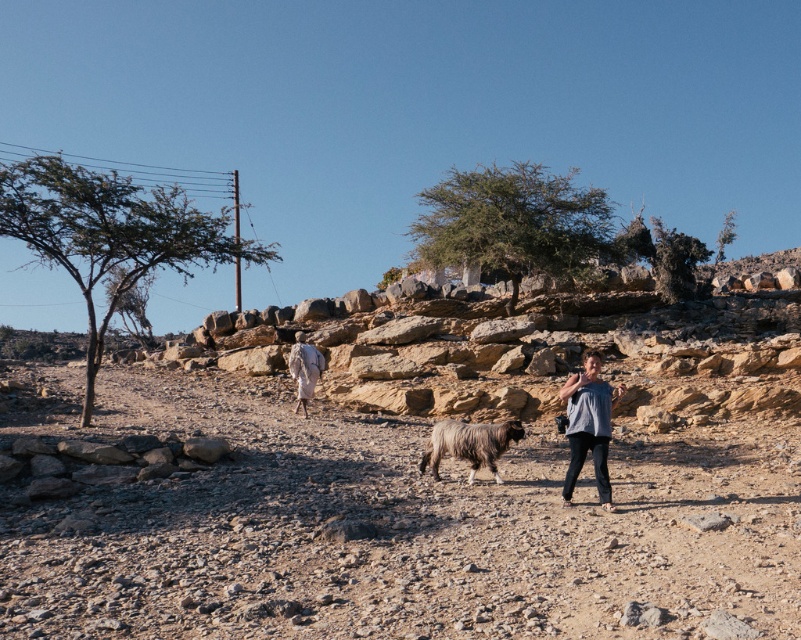
Does green leafy tree at center have a lesser width compared to green leafy tree at upper right?

In fact, green leafy tree at center might be wider than green leafy tree at upper right.

Which is behind, point (501, 252) or point (723, 236)?

Positioned behind is point (723, 236).

Is point (522, 262) positioned before point (731, 234)?

Yes, it is.

The height and width of the screenshot is (640, 801). Find the location of `green leafy tree at center`. green leafy tree at center is located at coordinates (513, 221).

Does green leafy tree at left have a greater width compared to green leafy tree at center?

Indeed, green leafy tree at left has a greater width compared to green leafy tree at center.

Between point (9, 230) and point (534, 172), which one is positioned in front?

Positioned in front is point (9, 230).

The height and width of the screenshot is (640, 801). In order to click on green leafy tree at left in this screenshot , I will do `click(111, 236)`.

Who is higher up, gray cotton shirt at center or green leafy tree at upper right?

green leafy tree at upper right is higher up.

Between point (602, 432) and point (727, 243), which one is positioned in front?

Positioned in front is point (602, 432).

Where is `gray cotton shirt at center`? This screenshot has height=640, width=801. gray cotton shirt at center is located at coordinates (590, 424).